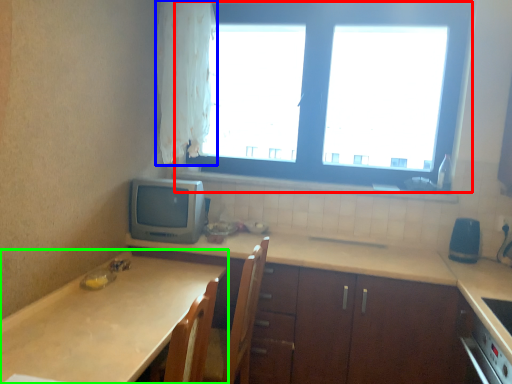
Question: Which is nearer to the window (highlighted by a red box)? curtain (highlighted by a blue box) or countertop (highlighted by a green box).

Choices:
 (A) curtain
 (B) countertop

Answer: (A)